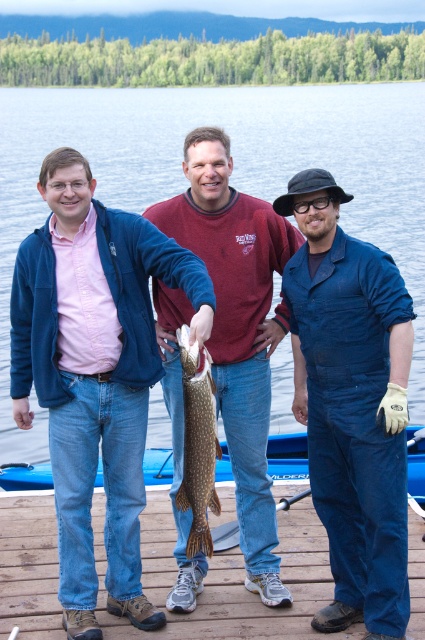
Measure the distance between matte pink shirt at center and blue plastic boat at lower center.

They are 2.60 meters apart.

Can you confirm if matte pink shirt at center is wider than blue plastic boat at lower center?

Correct, the width of matte pink shirt at center exceeds that of blue plastic boat at lower center.

Locate an element on the screen. matte pink shirt at center is located at coordinates click(x=95, y=372).

Is point (13, 605) behind point (30, 481)?

That is False.

Is point (102, 577) positioned behind point (286, 448)?

No, (102, 577) is closer to viewer.

What are the coordinates of `wooden dock at lower center` in the screenshot? It's located at (243, 589).

Does matte brown fish at center appear on the left side of wooden dock at lower center?

Indeed, matte brown fish at center is positioned on the left side of wooden dock at lower center.

Between point (215, 376) and point (40, 528), which one is positioned behind?

Point (40, 528)

Between point (206, 205) and point (342, 637), which one is positioned behind?

Positioned behind is point (206, 205).

Identify the location of matte brown fish at center. The height and width of the screenshot is (640, 425). (238, 328).